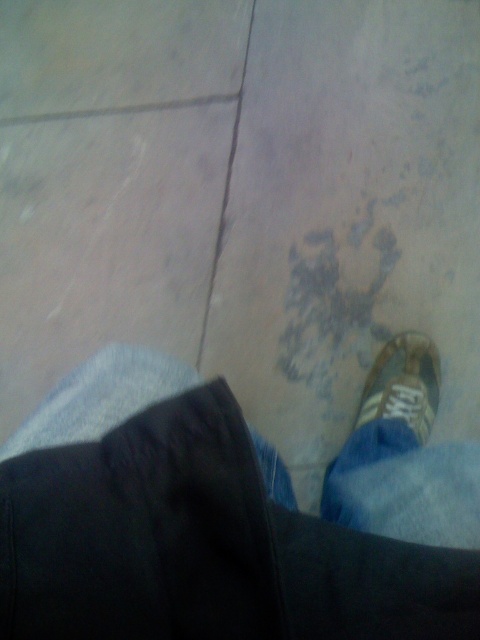
How much distance is there between denim pants at lower center and suede-like brown shoe at lower right?

They are 31.18 centimeters apart.

Does denim pants at lower center come in front of suede-like brown shoe at lower right?

Yes, it is in front of suede-like brown shoe at lower right.

Describe the element at coordinates (230, 515) in the screenshot. I see `denim pants at lower center` at that location.

The height and width of the screenshot is (640, 480). I want to click on denim pants at lower center, so click(230, 515).